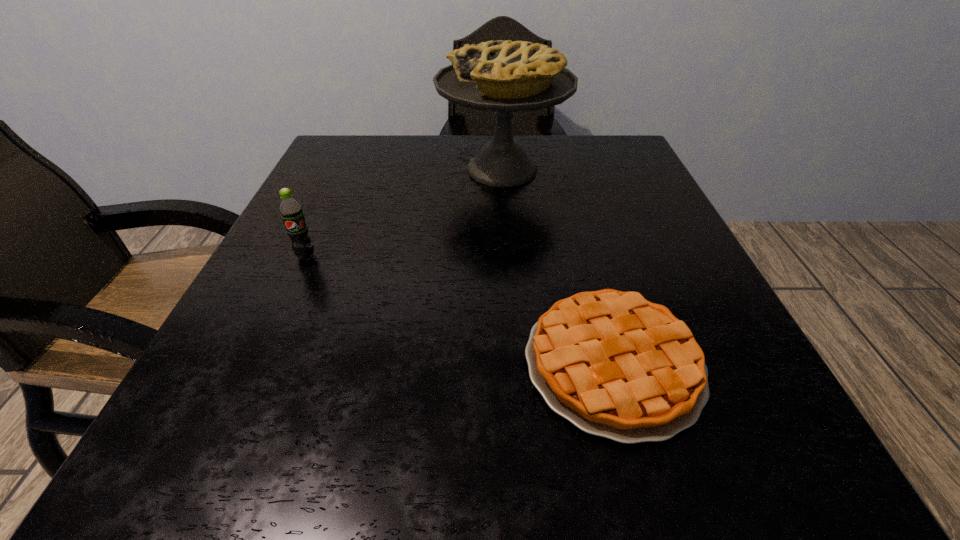
You are a GUI agent. You are given a task and a screenshot of the screen. Output one action in this format:
    pyautogui.click(x=<x>, y=<y>)
    Task: Click on the tallest object
    Image resolution: width=960 pixels, height=540 pixels.
    Given the screenshot: What is the action you would take?
    pyautogui.click(x=503, y=76)

Locate an element on the screen. This screenshot has height=540, width=960. the taller pie is located at coordinates (503, 76).

This screenshot has width=960, height=540. Identify the location of the second tallest object. (291, 211).

Identify the location of the second farthest object. (291, 211).

This screenshot has height=540, width=960. I want to click on the nearest object, so click(x=615, y=365).

The height and width of the screenshot is (540, 960). In order to click on the nearer pie in this screenshot , I will do `click(615, 365)`.

Locate an element on the screen. The width and height of the screenshot is (960, 540). free space located 0.270m on the cut side of the farthest object is located at coordinates (320, 170).

Identify the location of blank area located on the cut side of the farthest object. The image size is (960, 540). (377, 170).

Locate an element on the screen. This screenshot has height=540, width=960. vacant region located 0.050m on the cut side of the farthest object is located at coordinates (417, 170).

Find the location of a particular element. The width and height of the screenshot is (960, 540). vacant region located 0.210m on the front label of the soda is located at coordinates (257, 362).